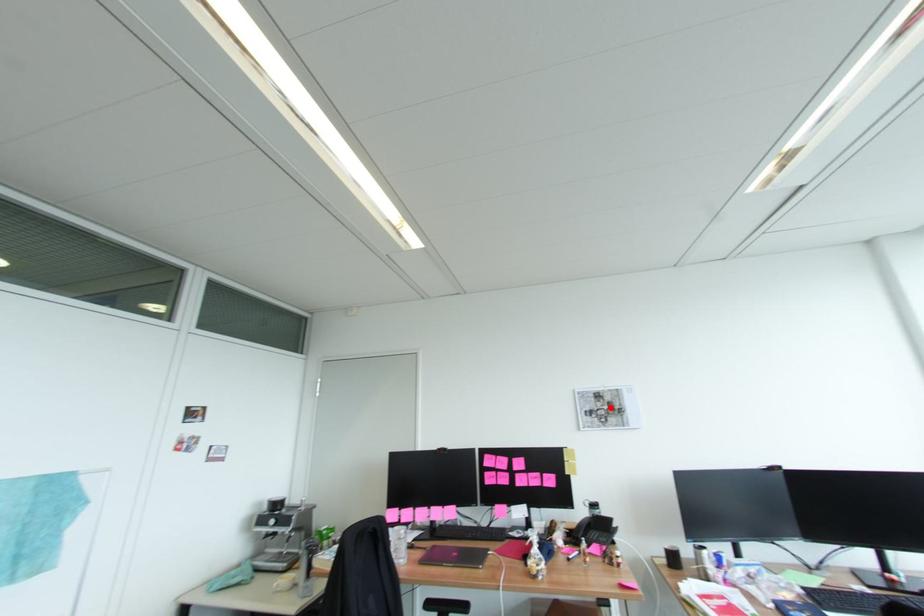
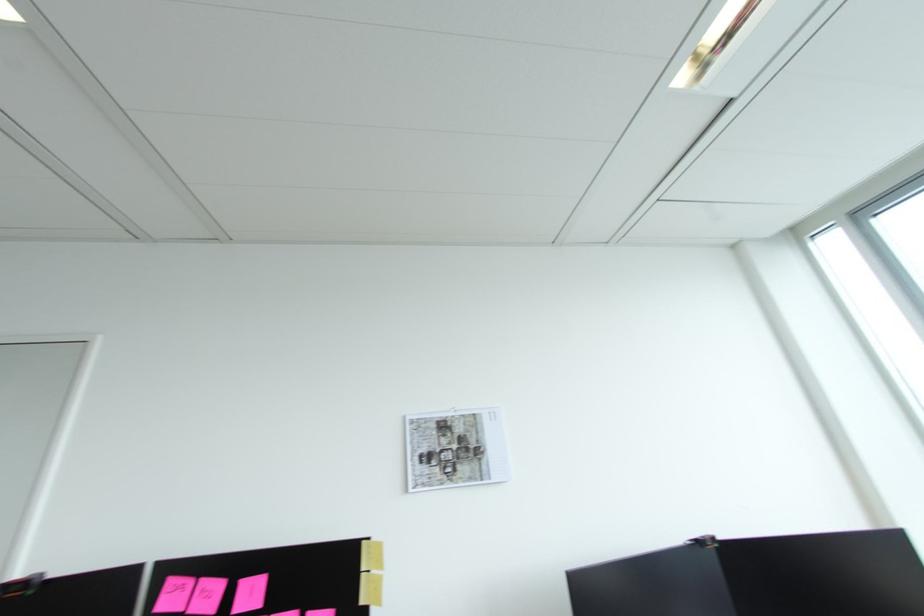
In the second image, find the point that corresponds to the highlighted location in the first image.

(459, 446)